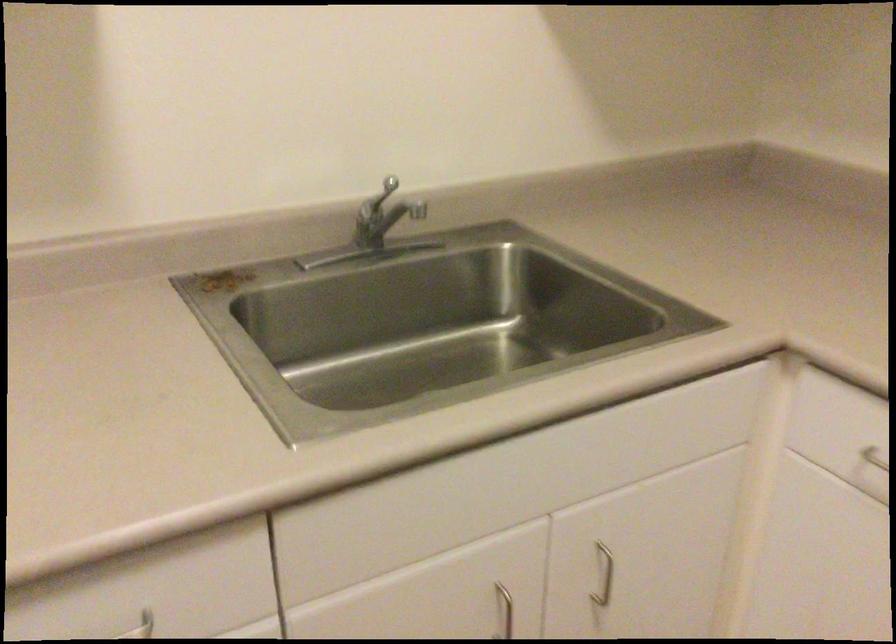
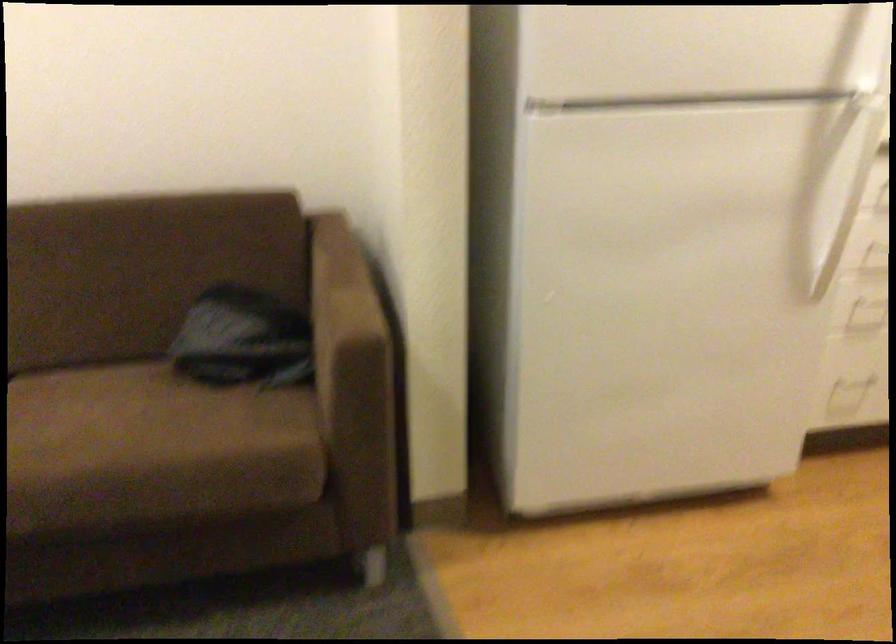
Which direction would the cameraman need to move to produce the second image?

The movement direction of the cameraman is left, backward.